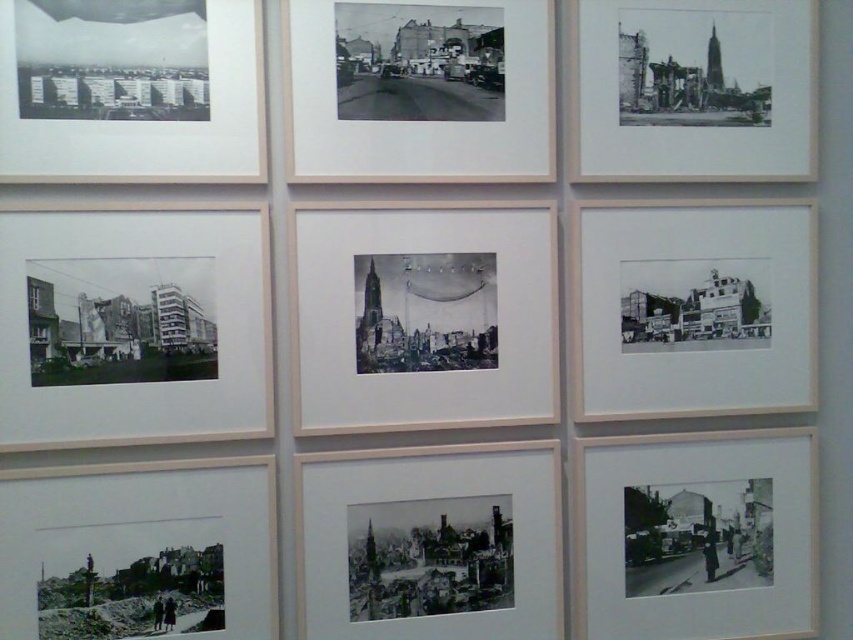
Based on the photo, you are an art curator planning to rearrange the photographs on the wall. You need to place a new decorative item between the black and white photograph of buildings at left and the smooth glossy photograph of cityscape at upper left. Is there enough space between them to fit a 20 cm wide decorative item?

The black and white photograph of buildings at left and the smooth glossy photograph of cityscape at upper left are 21.39 centimeters apart. Since the decorative item is 20 cm wide, there is sufficient space between them to fit it.